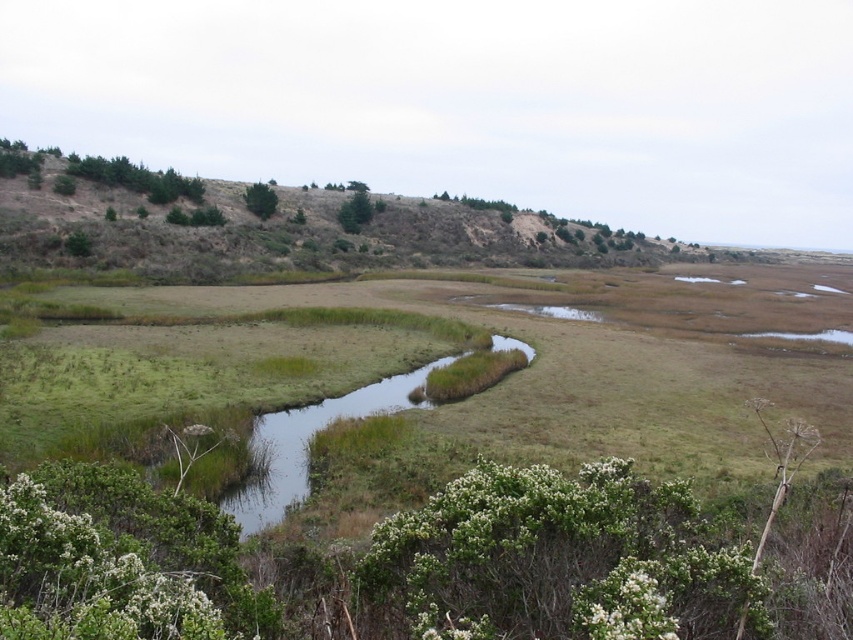
You are an ecologist studying the wetland area. You need to determine which object occupies a bigger area in the image between the brown textured hillside at upper left and the green leafy shrub at upper center. Which one is larger?

The brown textured hillside at upper left is larger in size than the green leafy shrub at upper center according to the description.

You are an ecologist studying the landscape. You observe the brown textured hillside at upper left and the green leafy shrub at upper center. Which of these two objects is positioned higher in the image?

The brown textured hillside at upper left is located above the green leafy shrub at upper center, so it is positioned higher in the image.

You are an environmental scientist observing the marshy wetland. You notice the brown textured hillside at upper left and the green leafy shrub at upper center. Which of these two objects is closer to your viewpoint?

The brown textured hillside at upper left is closer to the viewpoint because it is positioned in front of the green leafy shrub at upper center.